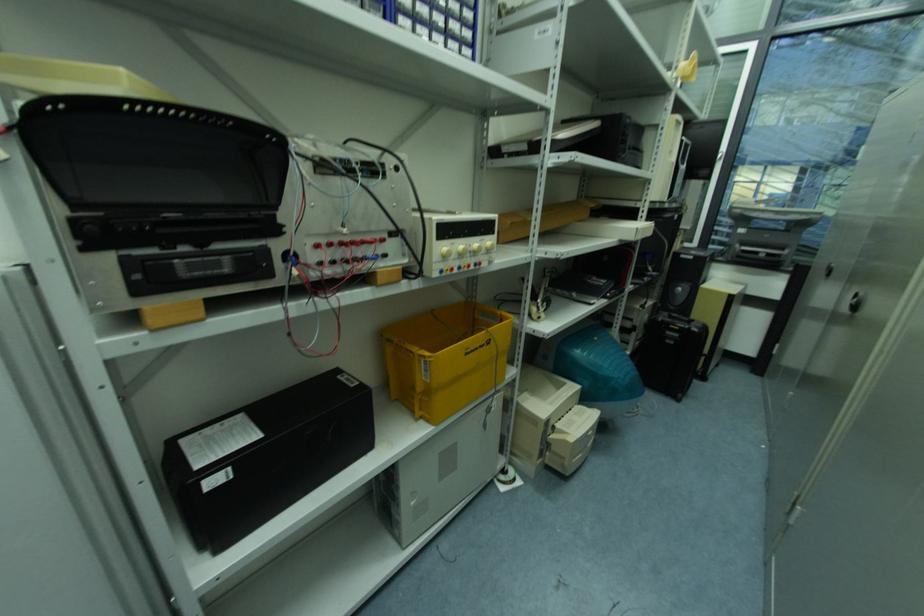
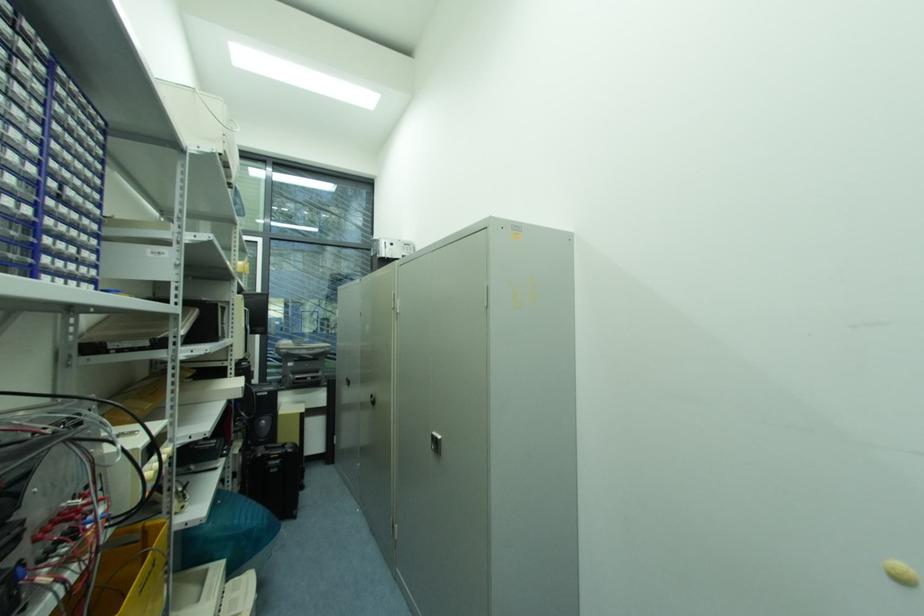
Question: The camera is either moving clockwise (left) or counter-clockwise (right) around the object. The first image is from the beginning of the video and the second image is from the end. Is the camera moving left or right when shooting the video?

Choices:
 (A) Left
 (B) Right

Answer: (A)